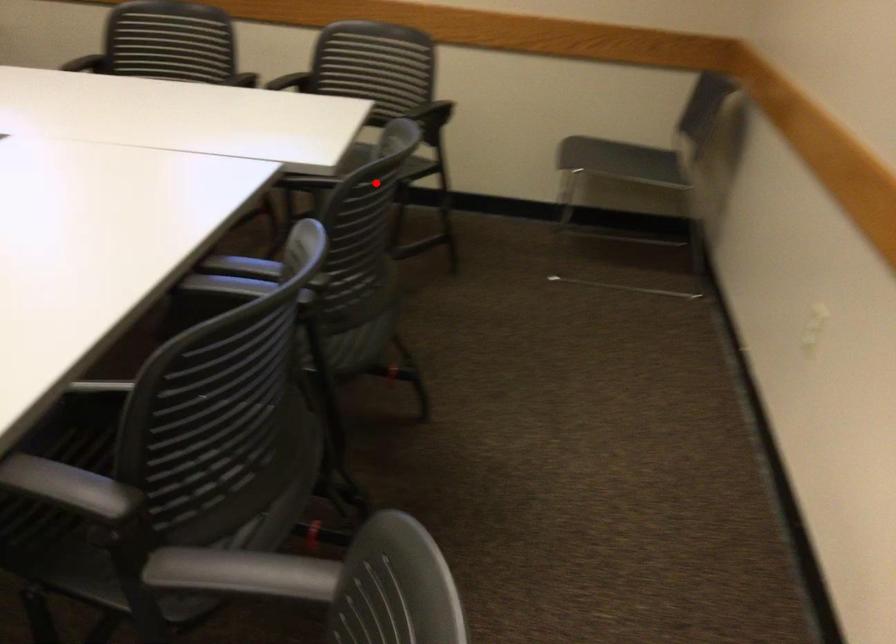
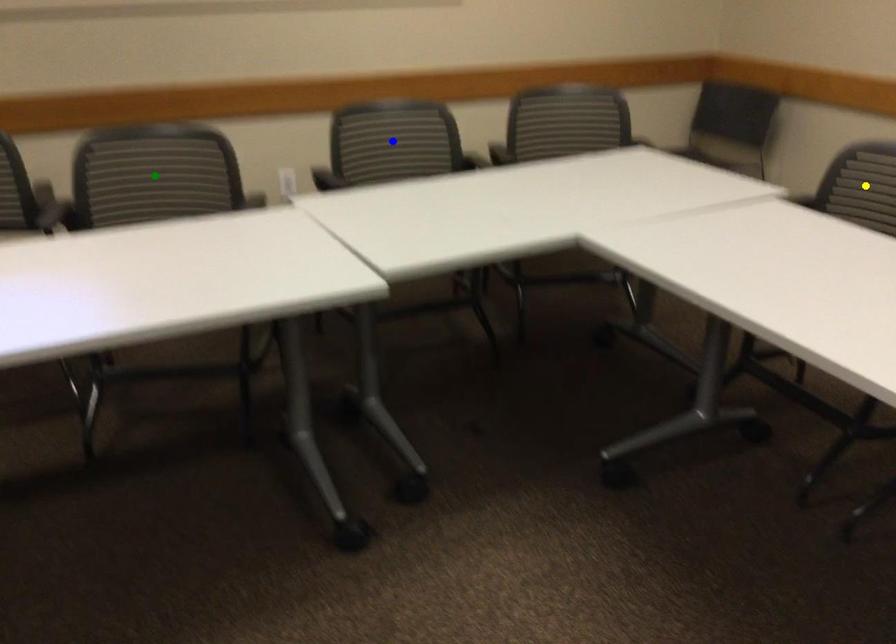
Question: I am providing you with two images of the same scene from different viewpoints. A red point is marked on the first image. You are given multiple points on the second image. Which point in image 2 is actually the same real-world point as the red point in image 1?

Choices:
 (A) blue point
 (B) yellow point
 (C) green point

Answer: (B)